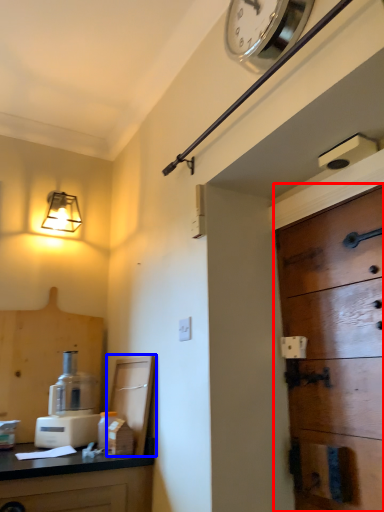
Question: Which object is further to the camera taking this photo, door (highlighted by a red box) or cabinetry (highlighted by a blue box)?

Choices:
 (A) door
 (B) cabinetry

Answer: (B)